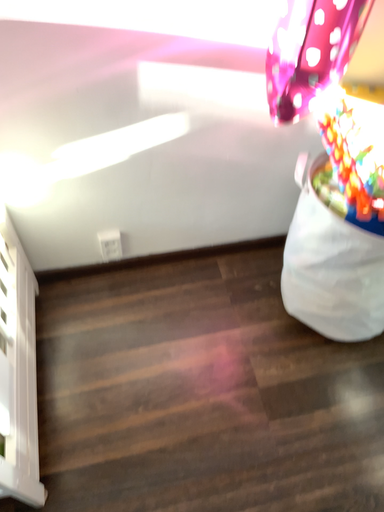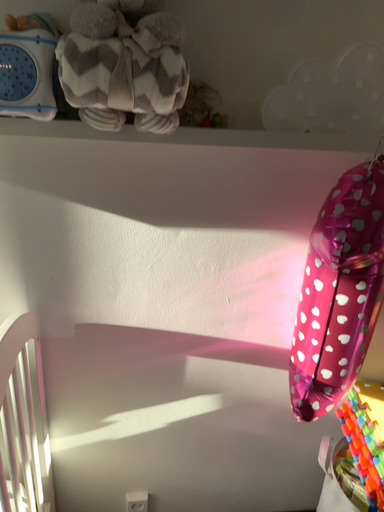
Question: Which way did the camera rotate in the video?

Choices:
 (A) rotated downward
 (B) rotated upward

Answer: (B)